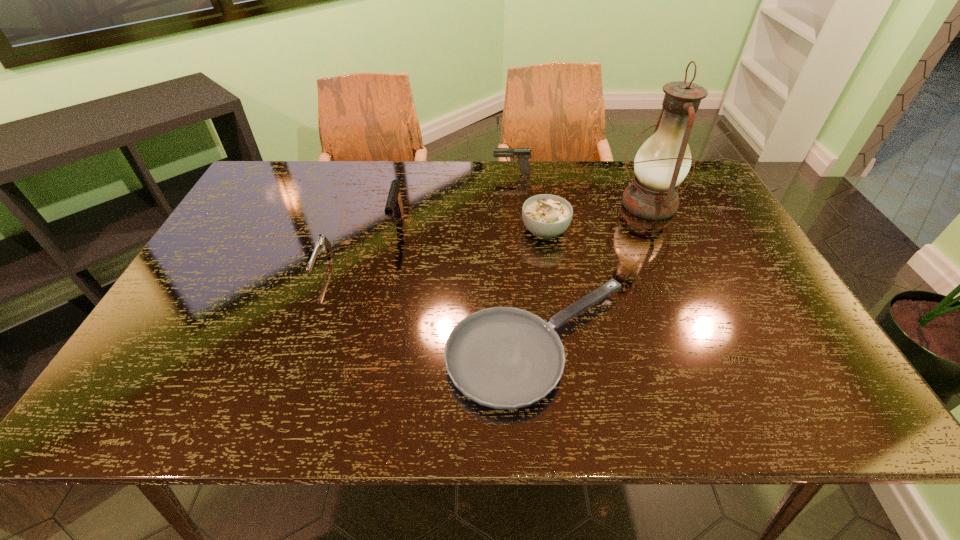
Where is `free space that is in between the second nearest pistol and the shortest object`? The width and height of the screenshot is (960, 540). free space that is in between the second nearest pistol and the shortest object is located at coordinates (468, 285).

Where is `object that ranks as the closest to the leftmost object`? The image size is (960, 540). object that ranks as the closest to the leftmost object is located at coordinates (394, 205).

Identify the location of object that is the third closest to the soup bowl. This screenshot has height=540, width=960. (523, 154).

Identify which pistol is the closest to the second tallest pistol. Please provide its 2D coordinates. Your answer should be formatted as a tuple, i.e. [(x, y)], where the tuple contains the x and y coordinates of a point satisfying the conditions above.

[(394, 205)]

The width and height of the screenshot is (960, 540). I want to click on the second closest pistol to the second nearest pistol, so click(x=523, y=154).

What are the coordinates of `vacant region that satisfies the following two spatial constraints: 1. aim along the barrel of the farthest pistol; 2. on the left side of the rightmost object` in the screenshot? It's located at (515, 204).

Find the location of a particular element. free spot that satisfies the following two spatial constraints: 1. at the barrel of the soup bowl; 2. on the left side of the fifth shortest object is located at coordinates tap(396, 231).

This screenshot has width=960, height=540. I want to click on vacant area that satisfies the following two spatial constraints: 1. on the back side of the soup bowl; 2. on the left side of the rightmost object, so [x=540, y=204].

The image size is (960, 540). I want to click on free spot that satisfies the following two spatial constraints: 1. at the barrel of the second object from left to right; 2. on the left side of the shortest object, so click(x=372, y=345).

Identify the location of free point that satisfies the following two spatial constraints: 1. aim along the barrel of the rightmost pistol; 2. on the right side of the tallest object. This screenshot has width=960, height=540. (515, 204).